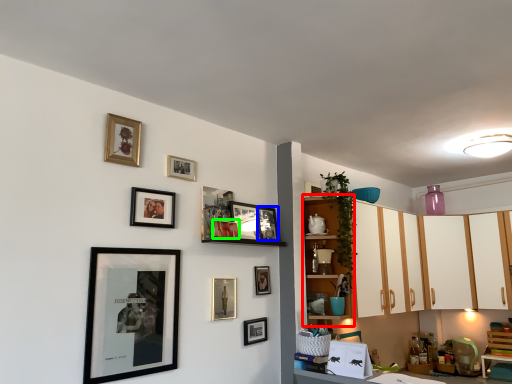
Question: Which object is positioned closest to cabinet (highlighted by a red box)? Select from picture frame (highlighted by a blue box) and picture frame (highlighted by a green box).

Choices:
 (A) picture frame
 (B) picture frame

Answer: (A)